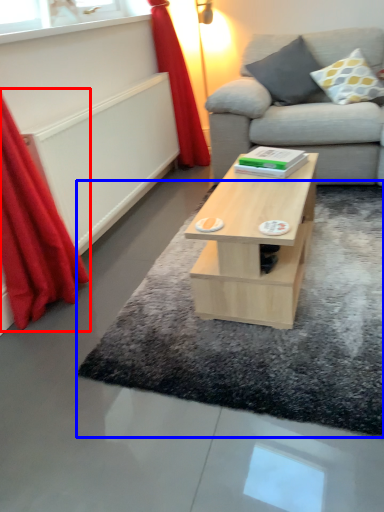
Question: Among these objects, which one is nearest to the camera, curtain (highlighted by a red box) or mat (highlighted by a blue box)?

Choices:
 (A) curtain
 (B) mat

Answer: (A)